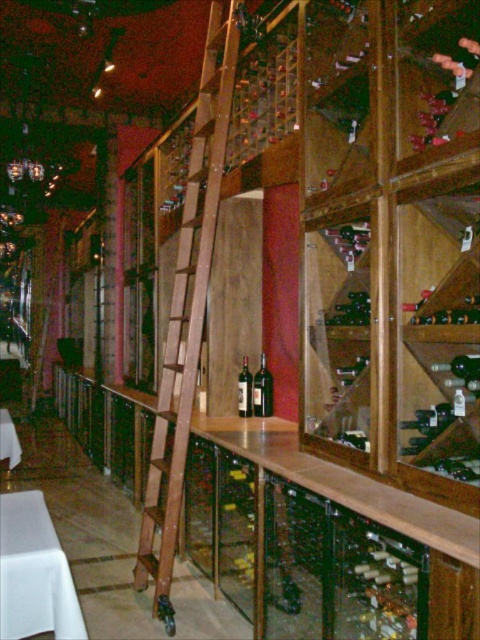
You are a wine collector who wants to move a wine bottle from the wooden wine rack at center to the brown wooden ladder at center. Can you reach the ladder without stepping on the floor?

The distance between the wooden wine rack at center and the brown wooden ladder at center is 3.29 feet. Since the ladder is positioned against the wall and the wine rack is nearby, you can easily reach the ladder from the wine rack without needing to step on the floor.

You are a wine collector who wants to store a large collection of wine bottles. You have a wooden wine rack at center and a brown wooden ladder at center in your cellar. Which object should you use to access the upper shelves where the bottles are stored?

The brown wooden ladder at center is larger than the wooden wine rack at center, so you should use the brown wooden ladder at center to reach the upper shelves.

You are a bartender preparing to set up a wine tasting event. You have a tray of glasses that needs to be placed on a surface. Given the scene, which object should you choose between the wooden wine rack at center and the white cloth table at lower left?

The white cloth table at lower left is the appropriate surface for placing the tray of glasses because the wooden wine rack at center is positioned on the right side of it, and wine racks are typically used for storing bottles rather than serving items.